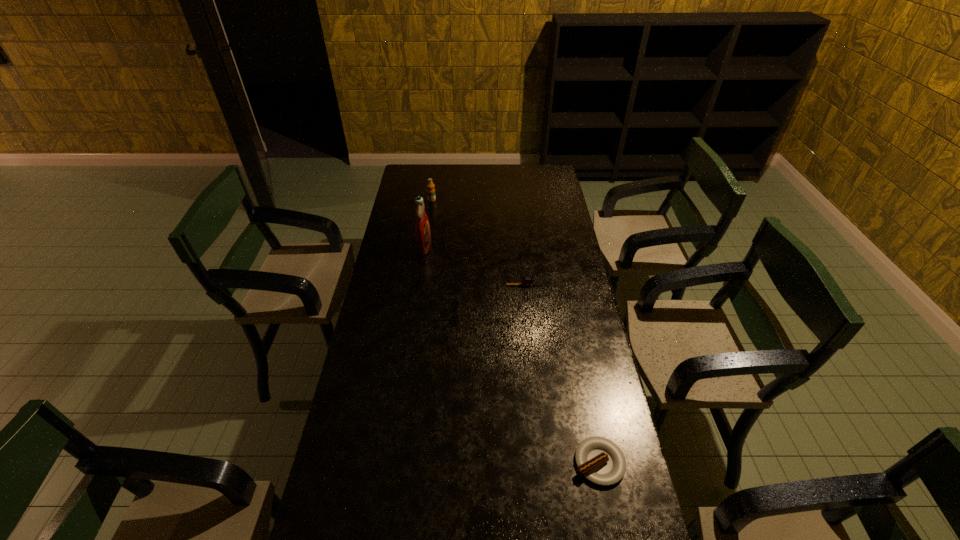
The width and height of the screenshot is (960, 540). What are the coordinates of `free spot at the left edge of the desktop` in the screenshot? It's located at (415, 211).

The width and height of the screenshot is (960, 540). In order to click on free space at the right edge of the desktop in this screenshot , I will do `click(566, 284)`.

The image size is (960, 540). In the image, there is a desktop. In order to click on blank space at the far left corner in this screenshot , I will do `click(425, 168)`.

The width and height of the screenshot is (960, 540). Identify the location of vacant space that is in between the third farthest object and the nearest object. coord(563,374).

The height and width of the screenshot is (540, 960). I want to click on empty location between the tallest object and the sausage, so click(512, 354).

Locate an element on the screen. This screenshot has width=960, height=540. free spot between the rightmost object and the sunglasses is located at coordinates (522, 387).

I want to click on vacant point located between the sausage and the third object from left to right, so click(x=522, y=387).

Identify the location of vacant space that's between the orange juice and the sausage. (516, 331).

Where is `empty space between the tallest object and the third object from right to left`? The width and height of the screenshot is (960, 540). empty space between the tallest object and the third object from right to left is located at coordinates (435, 279).

Image resolution: width=960 pixels, height=540 pixels. Find the location of `free space between the orange juice and the fourth farthest object`. free space between the orange juice and the fourth farthest object is located at coordinates (439, 255).